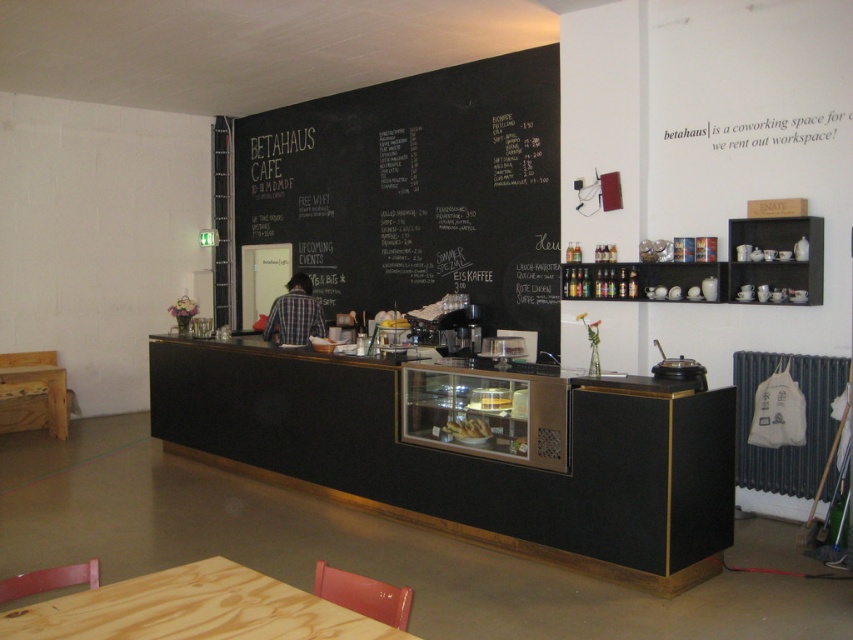
Question: Can you confirm if black chalkboard at center is smaller than translucent glass cake at center?

Choices:
 (A) yes
 (B) no

Answer: (B)

Question: Does plaid shirt at center appear over translucent glass cake at center?

Choices:
 (A) yes
 (B) no

Answer: (A)

Question: Which object appears closest to the camera in this image?

Choices:
 (A) plaid shirt at center
 (B) black chalkboard at center

Answer: (B)

Question: Which point is farther to the camera?

Choices:
 (A) wooden table at lower left
 (B) pine wood table at lower left
 (C) black chalkboard at center

Answer: (A)

Question: Which object is positioned farthest from the translucent glass cake at center?

Choices:
 (A) black wood table at center
 (B) wooden table at lower left
 (C) pine wood table at lower left

Answer: (B)

Question: In this image, where is black chalkboard at center located relative to plaid shirt at center?

Choices:
 (A) right
 (B) left

Answer: (A)